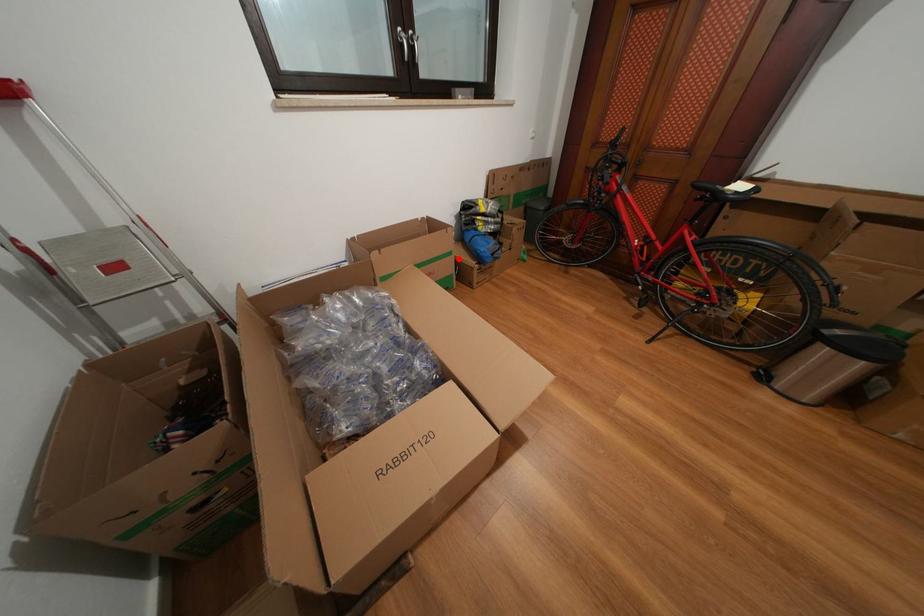
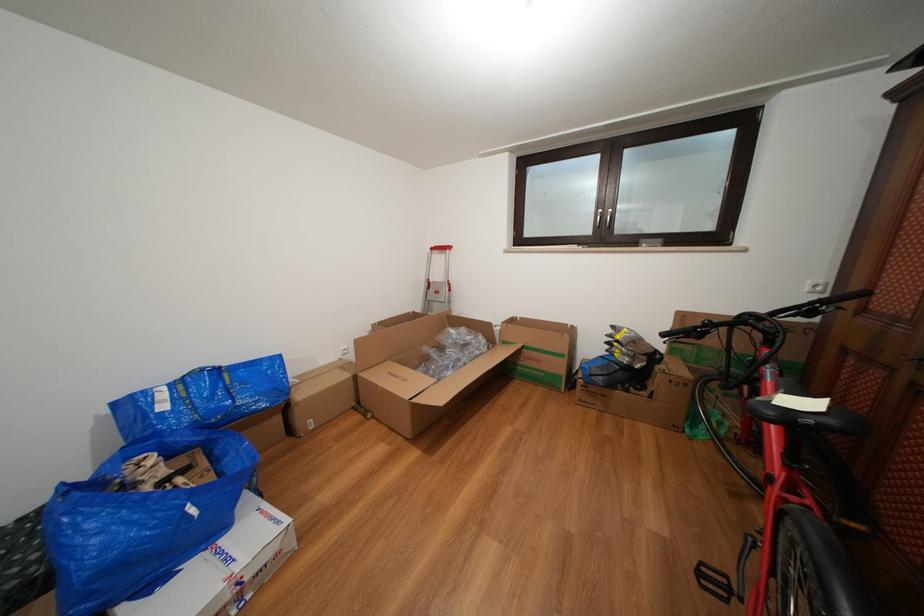
Where in the second image is the point corresponding to the highlighted location from the first image?

(570, 361)